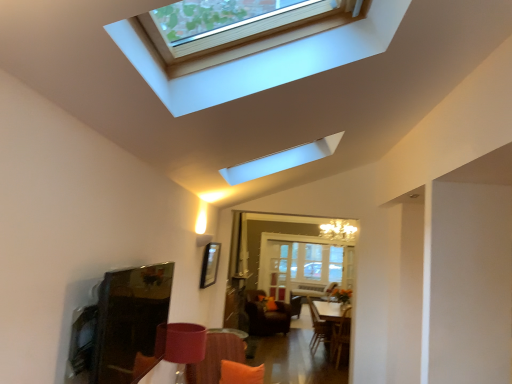
The height and width of the screenshot is (384, 512). I want to click on white glossy table at center, so click(x=330, y=327).

What do you see at coordinates (266, 316) in the screenshot?
I see `velvet brown swivel chair at center, placed as the 1th swivel chair when sorted from back to front` at bounding box center [266, 316].

Measure the distance between wooden swivel chair at center, arranged as the first swivel chair when viewed from the front, and camera.

They are 21.68 feet apart.

Where is `matte white window at upper center`? The width and height of the screenshot is (512, 384). matte white window at upper center is located at coordinates (263, 60).

From the picture: Is matte white window at upper center completely or partially inside velvet brown swivel chair at center, which is counted as the 2th swivel chair, starting from the right?

No, matte white window at upper center is located outside of velvet brown swivel chair at center, which is counted as the 2th swivel chair, starting from the right.

Between velvet brown swivel chair at center, placed as the first swivel chair when sorted from left to right, and matte white window at upper center, which one is positioned in front?

matte white window at upper center is closer to the camera.

Which is behind, point (288, 318) or point (259, 68)?

The point (288, 318) is farther from the camera.

From the image's perspective, is velvet brown swivel chair at center, the 2th swivel chair when ordered from front to back, above or below matte white window at upper center?

Based on their image positions, velvet brown swivel chair at center, the 2th swivel chair when ordered from front to back, is located beneath matte white window at upper center.

Can we say velvet brown swivel chair at center, which is counted as the 2th swivel chair, starting from the right, lies outside velvet orange armchair at lower center?

Yes, velvet brown swivel chair at center, which is counted as the 2th swivel chair, starting from the right, is outside of velvet orange armchair at lower center.

From the picture: Is velvet brown swivel chair at center, placed as the 1th swivel chair when sorted from back to front, aimed at velvet orange armchair at lower center?

Yes, velvet brown swivel chair at center, placed as the 1th swivel chair when sorted from back to front, is oriented towards velvet orange armchair at lower center.

From the image's perspective, is velvet brown swivel chair at center, placed as the 1th swivel chair when sorted from back to front, located above velvet orange armchair at lower center?

No, from the image's perspective, velvet brown swivel chair at center, placed as the 1th swivel chair when sorted from back to front, is not over velvet orange armchair at lower center.

Is white glossy table at center to the left or to the right of orange fabric pillow at lower center in the image?

In the image, white glossy table at center appears on the right side of orange fabric pillow at lower center.

Is point (324, 322) closer or farther from the camera than point (242, 364)?

Point (324, 322) is farther from the camera than point (242, 364).

Between white glossy table at center and orange fabric pillow at lower center, which one has smaller size?

Smaller between the two is orange fabric pillow at lower center.

Is white glossy table at center shorter than orange fabric pillow at lower center?

In fact, white glossy table at center may be taller than orange fabric pillow at lower center.

From a real-world perspective, relative to wooden swivel chair at center, positioned as the second swivel chair in left-to-right order, is matte white window at upper center vertically above or below?

In terms of real-world spatial position, matte white window at upper center is above wooden swivel chair at center, positioned as the second swivel chair in left-to-right order.

From the picture: Who is shorter, matte white window at upper center or wooden swivel chair at center, arranged as the first swivel chair when viewed from the front?

Standing shorter between the two is matte white window at upper center.

Considering the points (298, 52) and (318, 330), which point is behind, point (298, 52) or point (318, 330)?

The point (318, 330) is farther from the camera.

Is matte white window at upper center at the back of clear glass door at center?

That's not correct — clear glass door at center is not looking away from matte white window at upper center.

Is clear glass door at center further to camera compared to matte white window at upper center?

Yes, clear glass door at center is further from the viewer.

This screenshot has width=512, height=384. In the image, there is a clear glass door at center. In order to click on window above it (from the image's perspective) in this screenshot , I will do `click(263, 60)`.

Which of these two, clear glass door at center or matte white window at upper center, is bigger?

clear glass door at center is bigger.

From the image's perspective, between matte white window at upper center and velvet brown swivel chair at center, which is counted as the 2th swivel chair, starting from the right, who is located below?

velvet brown swivel chair at center, which is counted as the 2th swivel chair, starting from the right, is shown below in the image.

Is matte white window at upper center oriented away from velvet brown swivel chair at center, placed as the first swivel chair when sorted from left to right?

matte white window at upper center is not turned away from velvet brown swivel chair at center, placed as the first swivel chair when sorted from left to right.

Which is in front, point (151, 56) or point (276, 318)?

The point (151, 56) is in front.

Is matte white window at upper center located outside velvet brown swivel chair at center, which is counted as the 2th swivel chair, starting from the right?

matte white window at upper center is positioned outside velvet brown swivel chair at center, which is counted as the 2th swivel chair, starting from the right.

How different are the orientations of orange fabric pillow at lower center and orange fabric couch at lower center in degrees?

orange fabric pillow at lower center and orange fabric couch at lower center are facing 24.6 degrees away from each other.

Is orange fabric pillow at lower center far from orange fabric couch at lower center?

No, orange fabric pillow at lower center is in close proximity to orange fabric couch at lower center.

From a real-world perspective, relative to orange fabric couch at lower center, is orange fabric pillow at lower center vertically above or below?

orange fabric pillow at lower center is situated lower than orange fabric couch at lower center in the real world.

From the image's perspective, which is above, orange fabric pillow at lower center or orange fabric couch at lower center?

orange fabric couch at lower center is shown above in the image.

Where is `window above the velvet brown swivel chair at center, placed as the 1th swivel chair when sorted from back to front (from the image's perspective)`? This screenshot has width=512, height=384. window above the velvet brown swivel chair at center, placed as the 1th swivel chair when sorted from back to front (from the image's perspective) is located at coordinates (263, 60).

The width and height of the screenshot is (512, 384). Find the location of `the 2nd swivel chair counting from the left side of the velvet orange armchair at lower center`. the 2nd swivel chair counting from the left side of the velvet orange armchair at lower center is located at coordinates point(266,316).

Looking at the image, which one is located closer to white glossy table at center, orange fabric couch at lower center or orange fabric pillow at lower center?

orange fabric pillow at lower center is positioned closer to the anchor white glossy table at center.

From the image, which object appears to be farther from orange fabric pillow at lower center, velvet orange armchair at lower center or clear glass door at center?

clear glass door at center.

From the image, which object appears to be nearer to velvet orange armchair at lower center, orange fabric couch at lower center or white glossy table at center?

white glossy table at center.

From the image, which object appears to be farther from wooden swivel chair at center, arranged as the first swivel chair when viewed from the front, matte white window at upper center or clear glass door at center?

The object further to wooden swivel chair at center, arranged as the first swivel chair when viewed from the front, is matte white window at upper center.

Based on their spatial positions, is white glossy table at center or velvet orange armchair at lower center further from wooden swivel chair at center, positioned as the second swivel chair in left-to-right order?

velvet orange armchair at lower center is further to wooden swivel chair at center, positioned as the second swivel chair in left-to-right order.

Considering their positions, is white glossy table at center positioned closer to clear glass door at center than wooden swivel chair at center, which appears as the 1th swivel chair when viewed from the right?

Among the two, white glossy table at center is located nearer to clear glass door at center.

Estimate the real-world distances between objects in this image. Which object is closer to clear glass door at center, matte white window at upper center or orange fabric couch at lower center?

orange fabric couch at lower center lies closer to clear glass door at center than the other object.

Looking at the image, which one is located closer to orange fabric couch at lower center, matte white window at upper center or wooden swivel chair at center, which appears as the 1th swivel chair when viewed from the right?

Among the two, matte white window at upper center is located nearer to orange fabric couch at lower center.

Where is `couch between matte white window at upper center and orange fabric pillow at lower center in the up-down direction`? couch between matte white window at upper center and orange fabric pillow at lower center in the up-down direction is located at coordinates (216, 358).

This screenshot has height=384, width=512. Find the location of `swivel chair positioned between white glossy table at center and velvet brown swivel chair at center, the 2th swivel chair when ordered from front to back, from near to far`. swivel chair positioned between white glossy table at center and velvet brown swivel chair at center, the 2th swivel chair when ordered from front to back, from near to far is located at coordinates (318, 328).

Image resolution: width=512 pixels, height=384 pixels. Find the location of `swivel chair positioned between matte white window at upper center and velvet brown swivel chair at center, the 2th swivel chair when ordered from front to back, from near to far`. swivel chair positioned between matte white window at upper center and velvet brown swivel chair at center, the 2th swivel chair when ordered from front to back, from near to far is located at coordinates (318, 328).

Where is `armchair between matte white window at upper center and clear glass door at center along the z-axis`? armchair between matte white window at upper center and clear glass door at center along the z-axis is located at coordinates (340, 335).